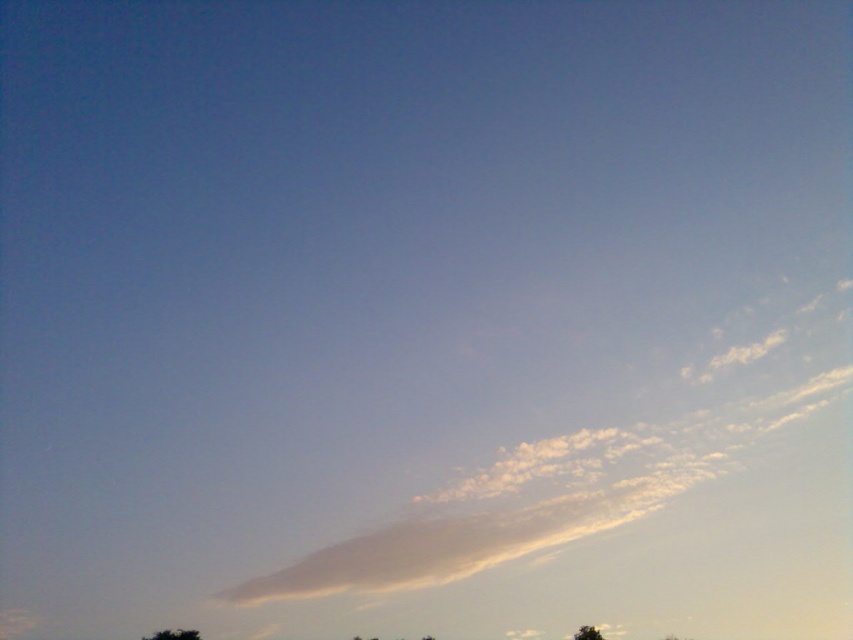
You are an airplane pilot flying at an altitude where you can see both the white fluffy cloud at center and the green leafy tree at lower right. Which object appears larger in the sky from your perspective?

The white fluffy cloud at center appears larger because it is taller than the green leafy tree at lower right.

You are an astronomer observing the sky and notice the white fluffy cloud at center and the green leafy tree at lower right. Which object is positioned higher in the sky?

The white fluffy cloud at center is positioned higher in the sky than the green leafy tree at lower right.